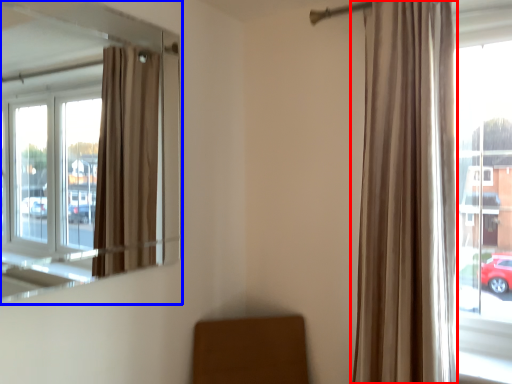
Question: Among these objects, which one is farthest to the camera, curtain (highlighted by a red box) or window (highlighted by a blue box)?

Choices:
 (A) curtain
 (B) window

Answer: (A)